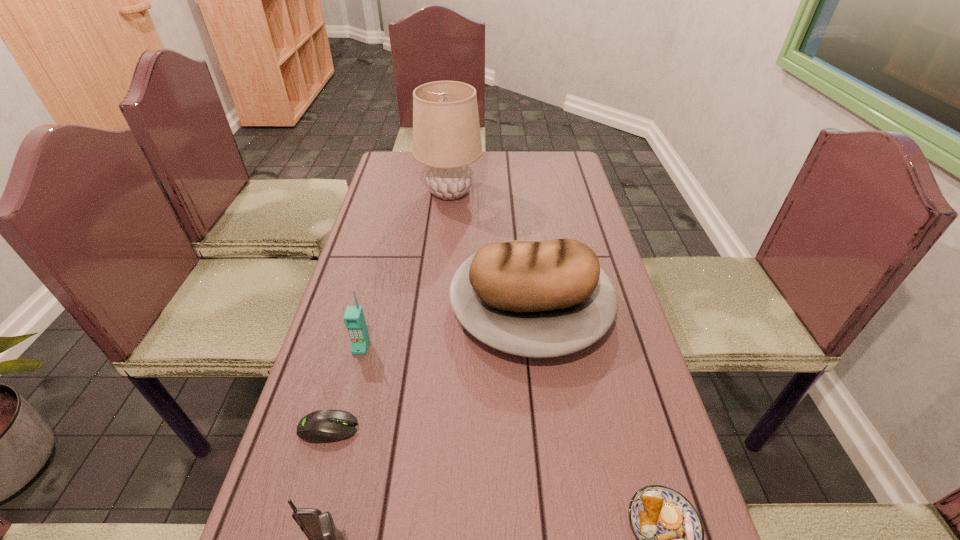
Identify the location of object that is at the far edge. The width and height of the screenshot is (960, 540). (446, 132).

Where is `lampshade that is at the left edge`? The width and height of the screenshot is (960, 540). lampshade that is at the left edge is located at coordinates (446, 132).

Where is `cellular telephone that is at the left edge`? cellular telephone that is at the left edge is located at coordinates (354, 319).

At what (x,y) coordinates should I click in order to perform the action: click on computer mouse at the left edge. Please return your answer as a coordinate pair (x, y). The image size is (960, 540). Looking at the image, I should click on (323, 426).

The width and height of the screenshot is (960, 540). In order to click on object that is positioned at the right edge in this screenshot , I will do `click(540, 299)`.

Find the location of a particular element. The width and height of the screenshot is (960, 540). object that is at the far left corner is located at coordinates (446, 132).

The height and width of the screenshot is (540, 960). What are the coordinates of `vacant space at the far edge of the desktop` in the screenshot? It's located at (495, 166).

At what (x,y) coordinates should I click in order to perform the action: click on free space at the left edge of the desktop. Please return your answer as a coordinate pair (x, y). The height and width of the screenshot is (540, 960). Looking at the image, I should click on (405, 217).

The image size is (960, 540). In order to click on vacant position at the right edge of the desktop in this screenshot , I will do `click(629, 335)`.

This screenshot has width=960, height=540. In order to click on free space at the far right corner in this screenshot , I will do tap(543, 154).